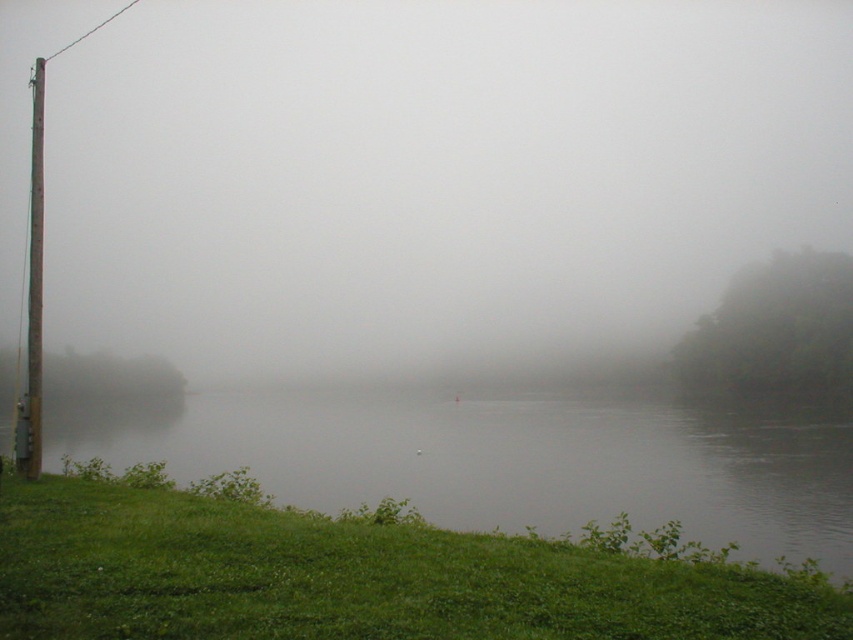
You are standing in the foggy landscape and notice two objects in the scene. Which object takes up more space in the image? Please choose between the green grassy hillside at lower left and the brown rough wooden pole at left.

The brown rough wooden pole at left takes up more space in the image than the green grassy hillside at lower left according to the description.

You are a photographer aiming to capture the brown rough wooden pole at left and the green grassy bank at lower left in your shot. Which of these two elements will occupy more space in your photograph?

The brown rough wooden pole at left occupies more space in the photograph than the green grassy bank at lower left because the green grassy bank at lower left is smaller than the brown rough wooden pole at left.

You are standing at the center of the image and want to move towards the green grassy hillside at lower left. In which direction should you walk?

You should walk towards the lower left direction to reach the green grassy hillside at lower left.